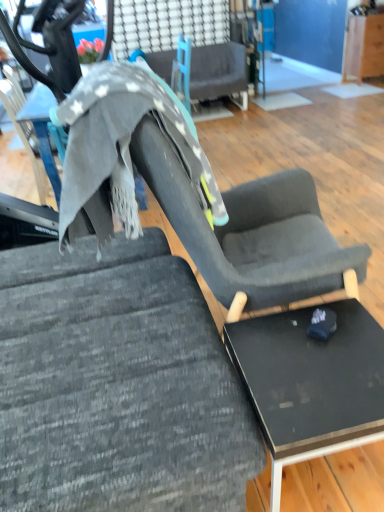
You are a GUI agent. You are given a task and a screenshot of the screen. Output one action in this format:
    pyautogui.click(x=<x>, y=<y>)
    Task: Click on the empty space that is ontop of black glossy table at lower right (from a real-world perspective)
    The width and height of the screenshot is (384, 512).
    Given the screenshot: What is the action you would take?
    pyautogui.click(x=317, y=367)